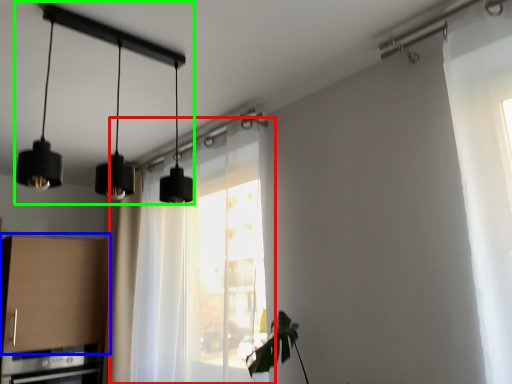
Question: Which is nearer to the window (highlighted by a red box)? cabinetry (highlighted by a blue box) or lamp (highlighted by a green box).

Choices:
 (A) cabinetry
 (B) lamp

Answer: (A)